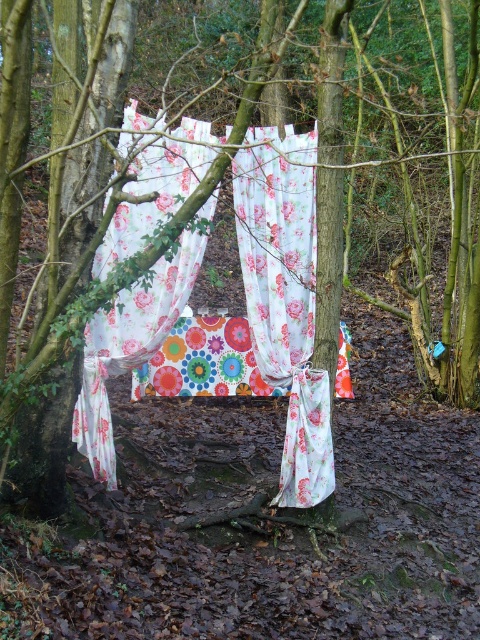
Question: Which point is closer to the camera?

Choices:
 (A) (289, 344)
 (B) (175, 166)

Answer: (B)

Question: Does floral fabric curtain at center have a smaller size compared to floral fabric tent at center?

Choices:
 (A) yes
 (B) no

Answer: (A)

Question: Which object appears farthest from the camera in this image?

Choices:
 (A) floral fabric curtain at center
 (B) floral fabric tent at center

Answer: (A)

Question: Which point is closer to the camera taking this photo?

Choices:
 (A) (244, 285)
 (B) (84, 420)

Answer: (B)

Question: Is floral fabric curtain at center above floral fabric tent at center?

Choices:
 (A) yes
 (B) no

Answer: (B)

Question: Is floral fabric curtain at center wider than floral fabric tent at center?

Choices:
 (A) yes
 (B) no

Answer: (B)